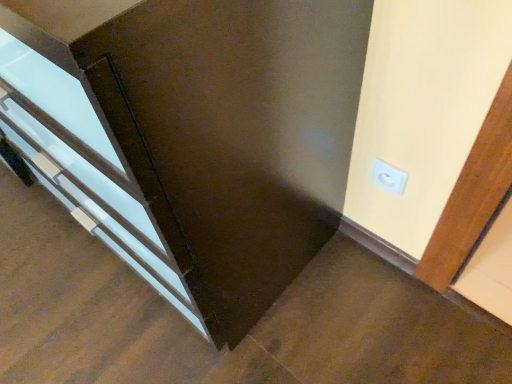
Question: Considering the relative sizes of matte white door at center and white plastic outlet at upper right in the image provided, is matte white door at center bigger than white plastic outlet at upper right?

Choices:
 (A) no
 (B) yes

Answer: (B)

Question: From a real-world perspective, is matte white door at center below white plastic outlet at upper right?

Choices:
 (A) yes
 (B) no

Answer: (B)

Question: Is matte white door at center facing away from white plastic outlet at upper right?

Choices:
 (A) yes
 (B) no

Answer: (B)

Question: Is matte white door at center placed right next to white plastic outlet at upper right?

Choices:
 (A) no
 (B) yes

Answer: (A)

Question: Does matte white door at center have a smaller size compared to white plastic outlet at upper right?

Choices:
 (A) no
 (B) yes

Answer: (A)

Question: Is the depth of matte white door at center greater than that of white plastic outlet at upper right?

Choices:
 (A) yes
 (B) no

Answer: (B)

Question: Is white plastic outlet at upper right positioned before matte white door at center?

Choices:
 (A) yes
 (B) no

Answer: (B)

Question: Considering the relative positions of white plastic outlet at upper right and matte white door at center in the image provided, is white plastic outlet at upper right behind matte white door at center?

Choices:
 (A) no
 (B) yes

Answer: (B)

Question: From a real-world perspective, is white plastic outlet at upper right physically below matte white door at center?

Choices:
 (A) no
 (B) yes

Answer: (B)

Question: Does white plastic outlet at upper right have a larger size compared to matte white door at center?

Choices:
 (A) yes
 (B) no

Answer: (B)

Question: Is white plastic outlet at upper right shorter than matte white door at center?

Choices:
 (A) yes
 (B) no

Answer: (A)

Question: Would you consider white plastic outlet at upper right to be distant from matte white door at center?

Choices:
 (A) yes
 (B) no

Answer: (B)

Question: In terms of size, does matte white door at center appear bigger or smaller than white plastic outlet at upper right?

Choices:
 (A) big
 (B) small

Answer: (A)